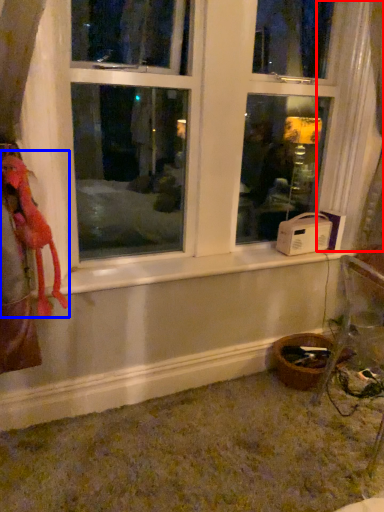
Question: Which point is closer to the camera, curtain (highlighted by a red box) or animal (highlighted by a blue box)?

Choices:
 (A) curtain
 (B) animal

Answer: (B)